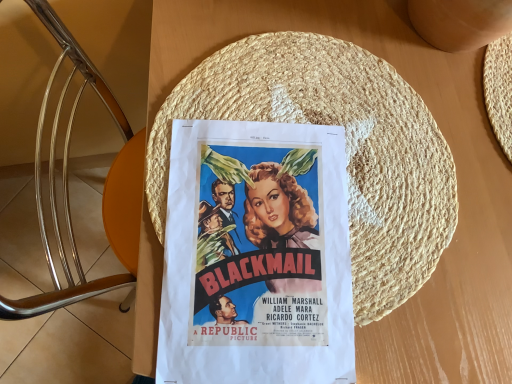
Where is `woven straw hat at center`? Image resolution: width=512 pixels, height=384 pixels. woven straw hat at center is located at coordinates (346, 149).

What do you see at coordinates (346, 149) in the screenshot?
I see `woven straw hat at center` at bounding box center [346, 149].

I want to click on matte paper poster at center, so click(256, 256).

The width and height of the screenshot is (512, 384). Describe the element at coordinates (256, 256) in the screenshot. I see `matte paper poster at center` at that location.

The width and height of the screenshot is (512, 384). What are the coordinates of `woven straw hat at center` in the screenshot? It's located at (346, 149).

From the picture: Which is more to the left, matte paper poster at center or woven straw hat at center?

From the viewer's perspective, matte paper poster at center appears more on the left side.

Is matte paper poster at center in front of or behind woven straw hat at center in the image?

matte paper poster at center is positioned closer to the viewer than woven straw hat at center.

Which is farther from the camera, (315, 318) or (401, 194)?

The point (401, 194) is farther from the camera.

From the image's perspective, relative to woven straw hat at center, is matte paper poster at center above or below?

From the image's perspective, matte paper poster at center appears below woven straw hat at center.

From a real-world perspective, is matte paper poster at center physically located above or below woven straw hat at center?

In terms of real-world spatial position, matte paper poster at center is below woven straw hat at center.

Considering the sizes of objects matte paper poster at center and woven straw hat at center in the image provided, who is thinner, matte paper poster at center or woven straw hat at center?

With smaller width is matte paper poster at center.

Does matte paper poster at center have a greater height compared to woven straw hat at center?

Yes, matte paper poster at center is taller than woven straw hat at center.

Looking at the image, does matte paper poster at center seem bigger or smaller compared to woven straw hat at center?

In the image, matte paper poster at center appears to be smaller than woven straw hat at center.

Is matte paper poster at center inside the boundaries of woven straw hat at center, or outside?

The correct answer is: inside.

Is matte paper poster at center positioned far away from woven straw hat at center?

That's not correct — matte paper poster at center is a little close to woven straw hat at center.

Is matte paper poster at center turned away from woven straw hat at center?

Yes, woven straw hat at center is at the back of matte paper poster at center.

How many degrees apart are the facing directions of matte paper poster at center and woven straw hat at center?

The angle between the facing direction of matte paper poster at center and the facing direction of woven straw hat at center is 7.66 degrees.

How far apart are matte paper poster at center and woven straw hat at center?

matte paper poster at center and woven straw hat at center are 2.79 inches apart.

This screenshot has height=384, width=512. Find the location of `poster in front of the woven straw hat at center`. poster in front of the woven straw hat at center is located at coordinates [x=256, y=256].

Can you confirm if woven straw hat at center is positioned to the left of matte paper poster at center?

Incorrect, woven straw hat at center is not on the left side of matte paper poster at center.

Who is more distant, woven straw hat at center or matte paper poster at center?

woven straw hat at center is behind.

Between point (446, 199) and point (306, 277), which one is positioned behind?

Positioned behind is point (446, 199).

From the image's perspective, is woven straw hat at center located above or below matte paper poster at center?

woven straw hat at center is situated higher than matte paper poster at center in the image.

From a real-world perspective, is woven straw hat at center positioned above or below matte paper poster at center?

In terms of real-world spatial position, woven straw hat at center is above matte paper poster at center.

Considering the sizes of objects woven straw hat at center and matte paper poster at center in the image provided, who is thinner, woven straw hat at center or matte paper poster at center?

Thinner between the two is matte paper poster at center.

Is woven straw hat at center shorter than matte paper poster at center?

Yes, woven straw hat at center is shorter than matte paper poster at center.

Between woven straw hat at center and matte paper poster at center, which one has larger size?

woven straw hat at center.

Is matte paper poster at center a part of woven straw hat at center?

That's correct, matte paper poster at center is inside woven straw hat at center.

Is woven straw hat at center touching matte paper poster at center?

Yes, woven straw hat at center is touching matte paper poster at center.

Is woven straw hat at center facing towards matte paper poster at center?

Yes, woven straw hat at center faces towards matte paper poster at center.

Can you tell me how much woven straw hat at center and matte paper poster at center differ in facing direction?

They differ by 7.66 degrees in their facing directions.

The width and height of the screenshot is (512, 384). What are the coordinates of `poster on the left of woven straw hat at center` in the screenshot? It's located at (256, 256).

Where is `straw hat above the matte paper poster at center (from a real-world perspective)`? Image resolution: width=512 pixels, height=384 pixels. straw hat above the matte paper poster at center (from a real-world perspective) is located at coordinates (346, 149).

Where is `straw hat on the right side of matte paper poster at center`? The height and width of the screenshot is (384, 512). straw hat on the right side of matte paper poster at center is located at coordinates (346, 149).